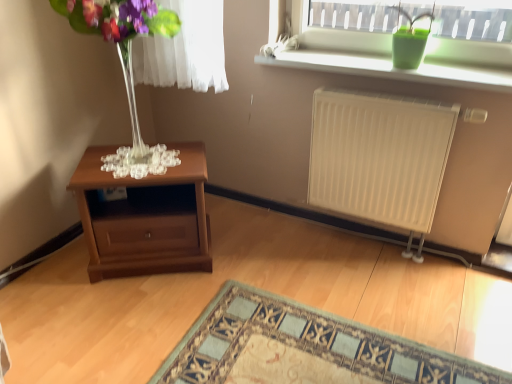
Find the location of a particular element. This screenshot has height=384, width=512. vacant region above mahogany wood nightstand at lower left (from a real-world perspective) is located at coordinates (143, 160).